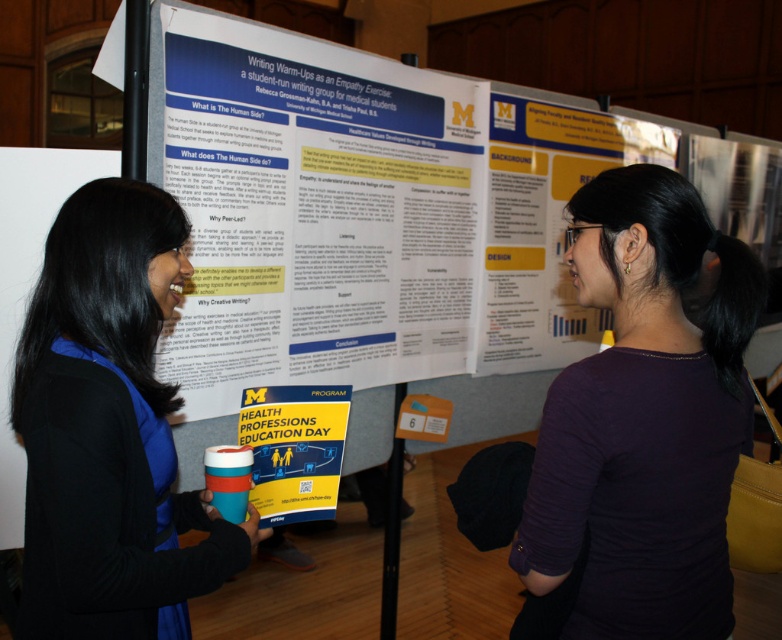
In the scene shown: Can you confirm if purple matte shirt at center is smaller than blue fabric shirt at left?

Yes, purple matte shirt at center is smaller than blue fabric shirt at left.

Image resolution: width=782 pixels, height=640 pixels. Identify the location of purple matte shirt at center. (644, 417).

What do you see at coordinates (109, 429) in the screenshot?
I see `blue fabric shirt at left` at bounding box center [109, 429].

Does blue fabric shirt at left appear on the right side of yellow paper program at center?

In fact, blue fabric shirt at left is to the left of yellow paper program at center.

Is point (110, 198) in front of point (303, 444)?

That is True.

Where is `blue fabric shirt at left`? This screenshot has height=640, width=782. blue fabric shirt at left is located at coordinates (109, 429).

Measure the distance between purple matte shirt at center and yellow paper program at center.

purple matte shirt at center and yellow paper program at center are 72.57 centimeters apart from each other.

Locate an element on the screen. This screenshot has height=640, width=782. purple matte shirt at center is located at coordinates (644, 417).

Locate an element on the screen. purple matte shirt at center is located at coordinates click(644, 417).